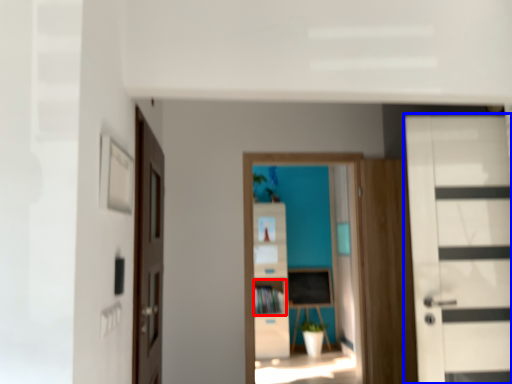
Question: Which object is closer to the camera taking this photo, cabinet (highlighted by a red box) or door (highlighted by a blue box)?

Choices:
 (A) cabinet
 (B) door

Answer: (B)